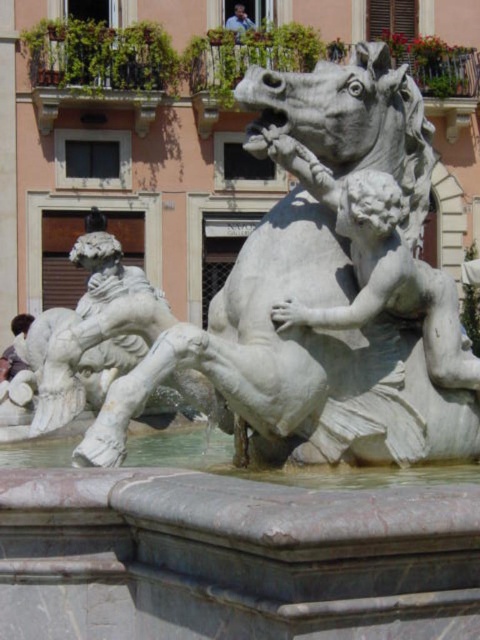
Question: Based on their relative distances, which object is farther from the white marble horse at center?

Choices:
 (A) dark brown hair at lower left
 (B) light blue shirt at upper center

Answer: (B)

Question: Based on their relative distances, which object is farther from the white marble horse at center?

Choices:
 (A) light blue shirt at upper center
 (B) dark brown hair at lower left

Answer: (A)

Question: Among these points, which one is farthest from the camera?

Choices:
 (A) (228, 22)
 (B) (348, 445)

Answer: (A)

Question: Can you confirm if white marble horse at center is wider than dark brown hair at lower left?

Choices:
 (A) no
 (B) yes

Answer: (B)

Question: Is dark brown hair at lower left above light blue shirt at upper center?

Choices:
 (A) yes
 (B) no

Answer: (B)

Question: Can you confirm if dark brown hair at lower left is wider than light blue shirt at upper center?

Choices:
 (A) no
 (B) yes

Answer: (B)